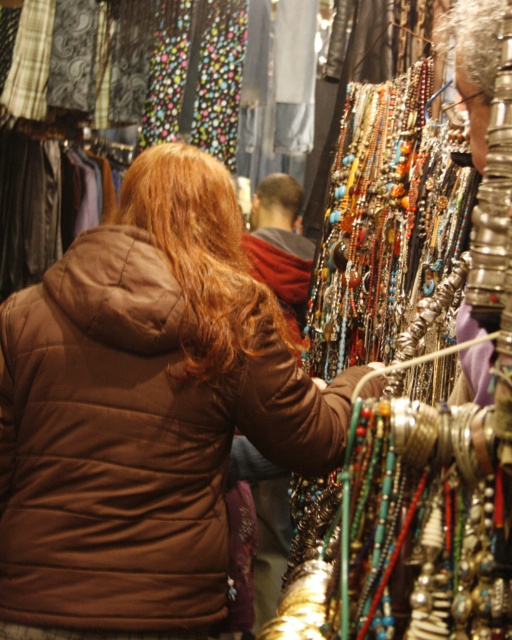
Question: Among these objects, which one is nearest to the camera?

Choices:
 (A) brown quilted jacket at center
 (B) brown shiny hair at upper center

Answer: (A)

Question: Which point is farther to the camera?

Choices:
 (A) (270, 182)
 (B) (211, 268)

Answer: (A)

Question: Can you confirm if brown quilted jacket at center is positioned to the right of brown wavy hair at center?

Choices:
 (A) no
 (B) yes

Answer: (A)

Question: Is brown quilted jacket at center above brown wavy hair at center?

Choices:
 (A) no
 (B) yes

Answer: (A)

Question: Does brown quilted jacket at center have a smaller size compared to brown wavy hair at center?

Choices:
 (A) no
 (B) yes

Answer: (A)

Question: Which of the following is the farthest from the observer?

Choices:
 (A) (112, 355)
 (B) (212, 337)

Answer: (B)